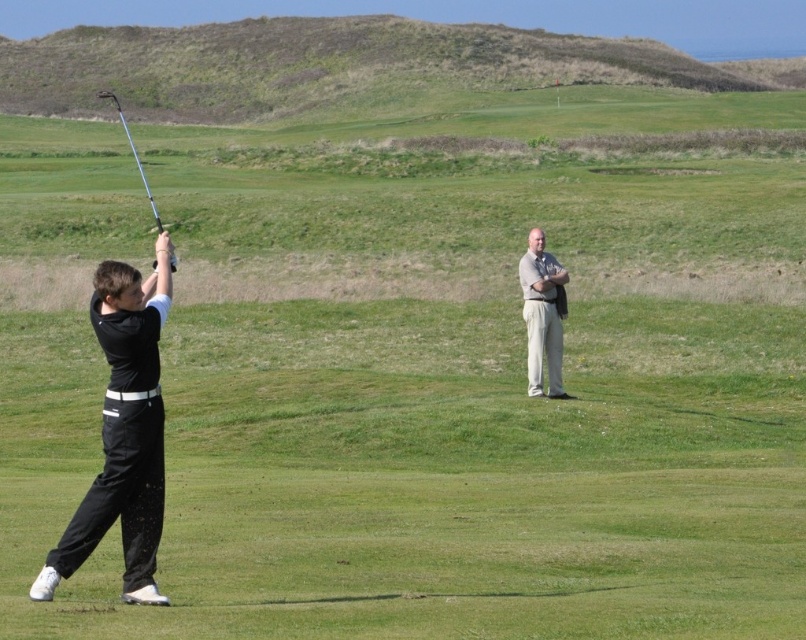
Question: Is black matte pants at left to the right of metallic silver golf club at left from the viewer's perspective?

Choices:
 (A) yes
 (B) no

Answer: (A)

Question: Which object is farther from the camera taking this photo?

Choices:
 (A) light beige pants at center
 (B) black matte pants at left
 (C) metallic silver golf club at left

Answer: (A)

Question: Is light beige pants at center positioned at the back of metallic silver golf club at left?

Choices:
 (A) yes
 (B) no

Answer: (A)

Question: Which point is farther to the camera?

Choices:
 (A) light beige pants at center
 (B) metallic silver golf club at left
 (C) black matte pants at left

Answer: (A)

Question: Is black matte pants at left smaller than metallic silver golf club at left?

Choices:
 (A) yes
 (B) no

Answer: (A)

Question: Which point is closer to the camera taking this photo?

Choices:
 (A) (98, 92)
 (B) (140, 483)

Answer: (B)